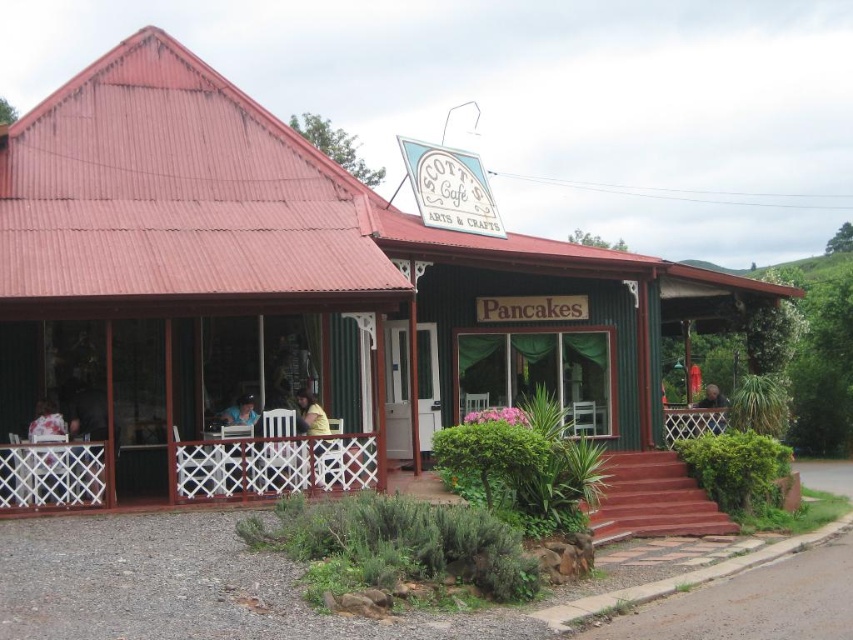
Does point (314, 484) lie behind point (717, 428)?

No.

The image size is (853, 640). Describe the element at coordinates (270, 467) in the screenshot. I see `white lattice porch at lower left` at that location.

You are a GUI agent. You are given a task and a screenshot of the screen. Output one action in this format:
    pyautogui.click(x=<x>, y=<y>)
    Task: Click on the white lattice porch at lower left
    The height and width of the screenshot is (640, 853).
    Given the screenshot: What is the action you would take?
    pyautogui.click(x=270, y=467)

Locate an element on the screen. Image resolution: width=853 pixels, height=640 pixels. white lattice porch at lower left is located at coordinates (270, 467).

Does white lattice porch at lower left have a larger size compared to white lace tablecloth at lower left?

Correct, white lattice porch at lower left is larger in size than white lace tablecloth at lower left.

Is point (697, 500) closer to camera compared to point (62, 451)?

No, it is not.

Find the location of a particular element. This screenshot has height=640, width=853. white lattice porch at lower left is located at coordinates (270, 467).

Does green wooden hut at center have a greater width compared to white lace tablecloth at lower left?

Correct, the width of green wooden hut at center exceeds that of white lace tablecloth at lower left.

Looking at this image, does green wooden hut at center appear under white lace tablecloth at lower left?

Actually, green wooden hut at center is above white lace tablecloth at lower left.

Which is in front, point (10, 128) or point (33, 448)?

Point (33, 448) is in front.

Locate an element on the screen. This screenshot has width=853, height=640. green wooden hut at center is located at coordinates (285, 292).